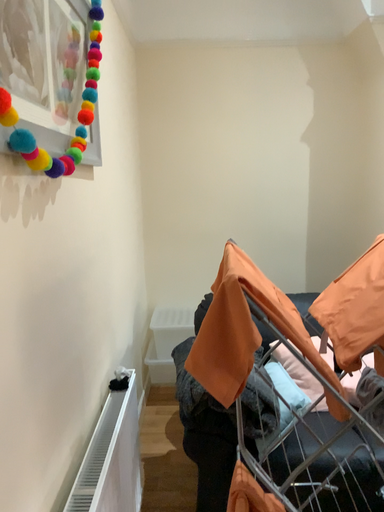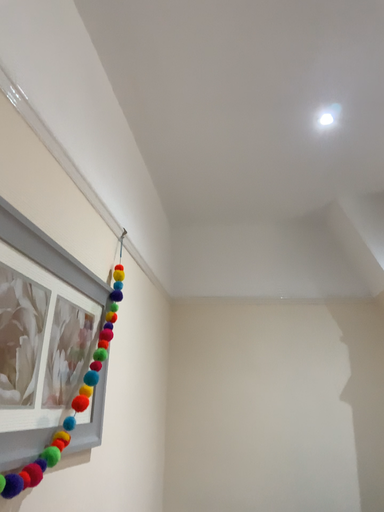
Question: How did the camera likely rotate when shooting the video?

Choices:
 (A) rotated left
 (B) rotated right

Answer: (A)